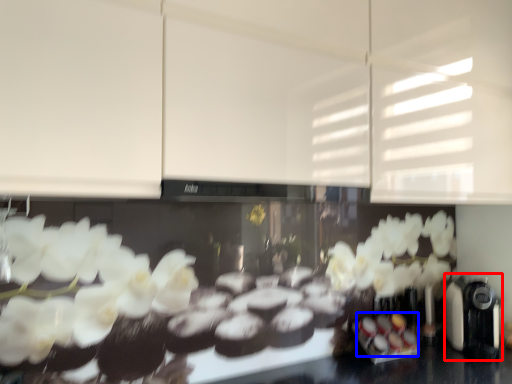
Question: Which point is closer to the camera, coffee machine (highlighted by a red box) or food (highlighted by a blue box)?

Choices:
 (A) coffee machine
 (B) food

Answer: (A)